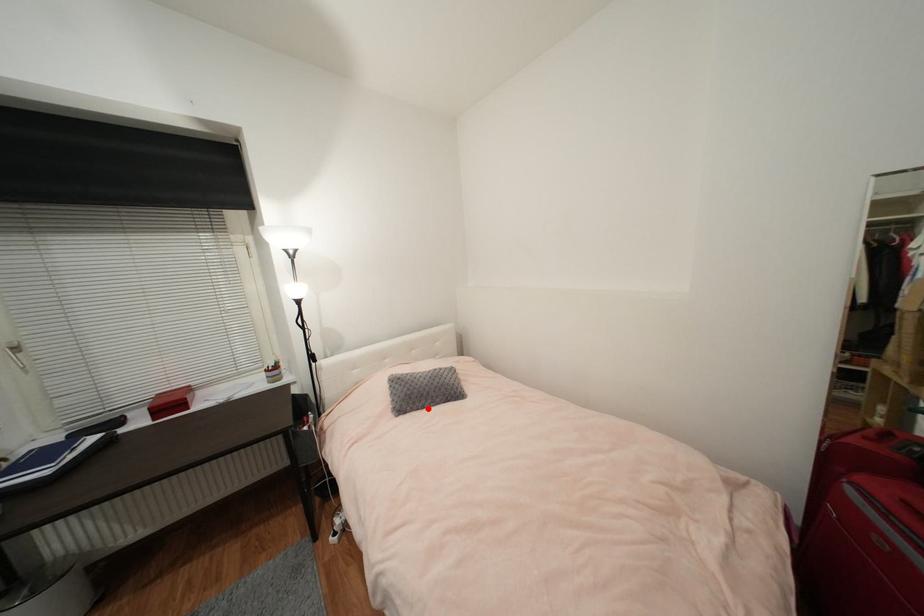
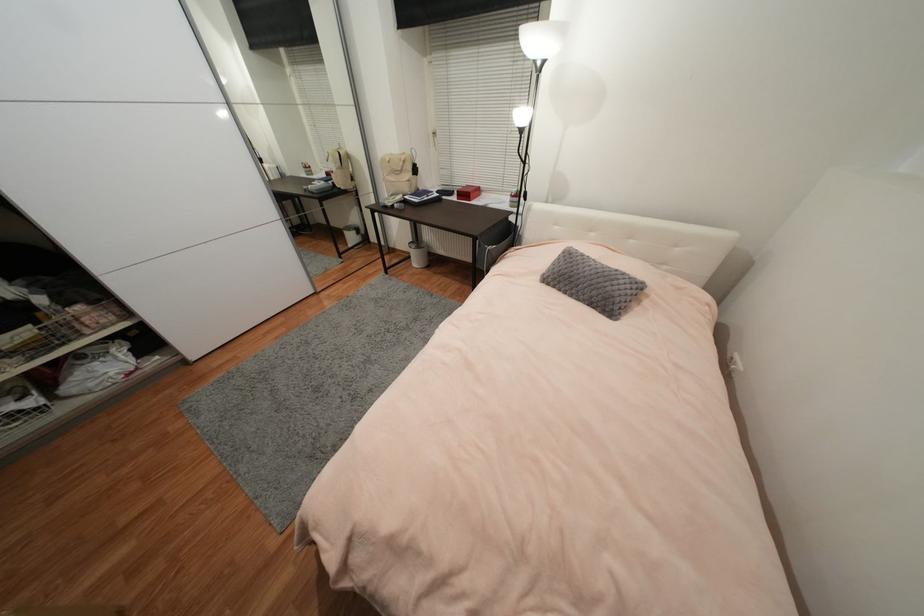
Question: I am providing you with two images of the same scene from different viewpoints. Image1 has a red point marked. In image2, the corresponding 3D location appears at what relative position? Reply with the corresponding letter.

Choices:
 (A) Closer
 (B) Farther

Answer: (A)